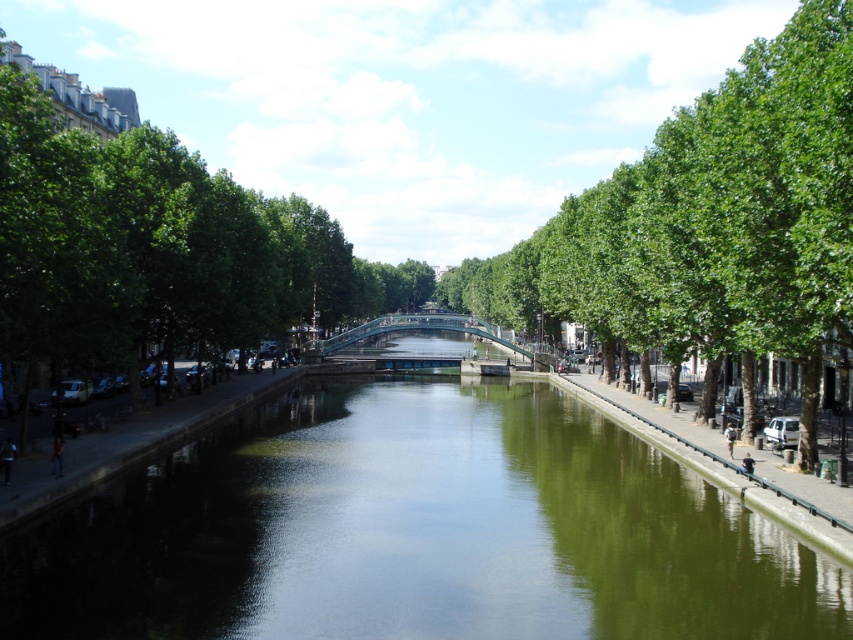
Which is more to the left, green reflective water at center or green leafy tree at right?

From the viewer's perspective, green reflective water at center appears more on the left side.

Is point (285, 513) closer to camera compared to point (804, 125)?

No, it is not.

You are a GUI agent. You are given a task and a screenshot of the screen. Output one action in this format:
    pyautogui.click(x=<x>, y=<y>)
    Task: Click on the green reflective water at center
    
    Given the screenshot: What is the action you would take?
    pyautogui.click(x=416, y=531)

Locate an element on the screen. This screenshot has width=853, height=640. green reflective water at center is located at coordinates (416, 531).

Can you confirm if green reflective water at center is smaller than green leafy tree at left?

Indeed, green reflective water at center has a smaller size compared to green leafy tree at left.

The image size is (853, 640). What do you see at coordinates (416, 531) in the screenshot?
I see `green reflective water at center` at bounding box center [416, 531].

Between point (491, 493) and point (387, 284), which one is positioned behind?

The point (387, 284) is behind.

The image size is (853, 640). Find the location of `green reflective water at center`. green reflective water at center is located at coordinates (416, 531).

Can you confirm if green leafy tree at right is positioned to the left of green leafy tree at left?

In fact, green leafy tree at right is to the right of green leafy tree at left.

Based on the photo, who is positioned more to the left, green leafy tree at right or green leafy tree at left?

green leafy tree at left

Who is more forward, (625,250) or (270,269)?

Point (625,250)

Identify the location of green leafy tree at right. This screenshot has width=853, height=640. (711, 221).